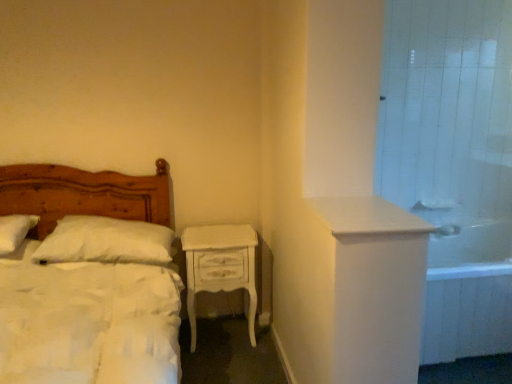
Question: Is point (437, 210) positioned closer to the camera than point (430, 243)?

Choices:
 (A) farther
 (B) closer

Answer: (A)

Question: From the image's perspective, is white glossy sink at upper right located above or below white tile shower door at upper right?

Choices:
 (A) above
 (B) below

Answer: (B)

Question: Which of these objects is positioned closest to the white tile shower door at upper right?

Choices:
 (A) wooden bed at left
 (B) white painted wood nightstand at center
 (C) white glossy bathtub at right
 (D) white soft pillow at left, which is counted as the first pillow, starting from the left
 (E) white glossy sink at upper right

Answer: (E)

Question: Which is nearer to the wooden bed at left?

Choices:
 (A) white glossy sink at upper right
 (B) white glossy bathtub at right
 (C) white soft pillow at left, which is counted as the first pillow, starting from the left
 (D) white soft pillow at left, the second pillow viewed from the left
 (E) white painted wood nightstand at center

Answer: (D)